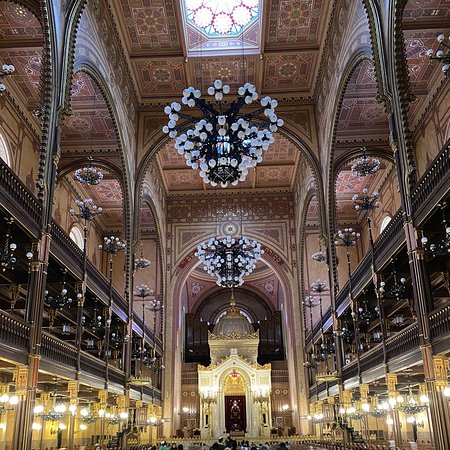
This screenshot has height=450, width=450. I want to click on altar, so click(x=235, y=432).